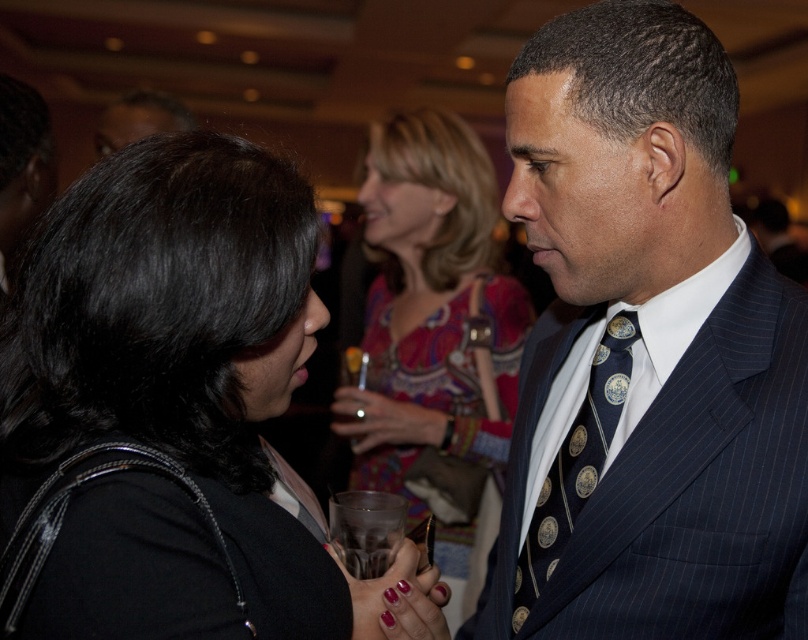
You are standing in the middle of the room and want to walk towards both the point at coordinates point (525, 620) and the point at coordinates point (182, 385). Which point will you reach first?

You will reach point (525, 620) first because it is closer to you than point (182, 385).

You are at a formal event and want to find a place to sit between the dark blue pinstripe suit at center and the printed silk blouse at center. Which side of the clothing items should you choose to ensure there is enough space for your chair?

The dark blue pinstripe suit at center has a lesser width compared to the printed silk blouse at center, so you should choose the side of the dark blue pinstripe suit at center to place your chair as there is more space available there.